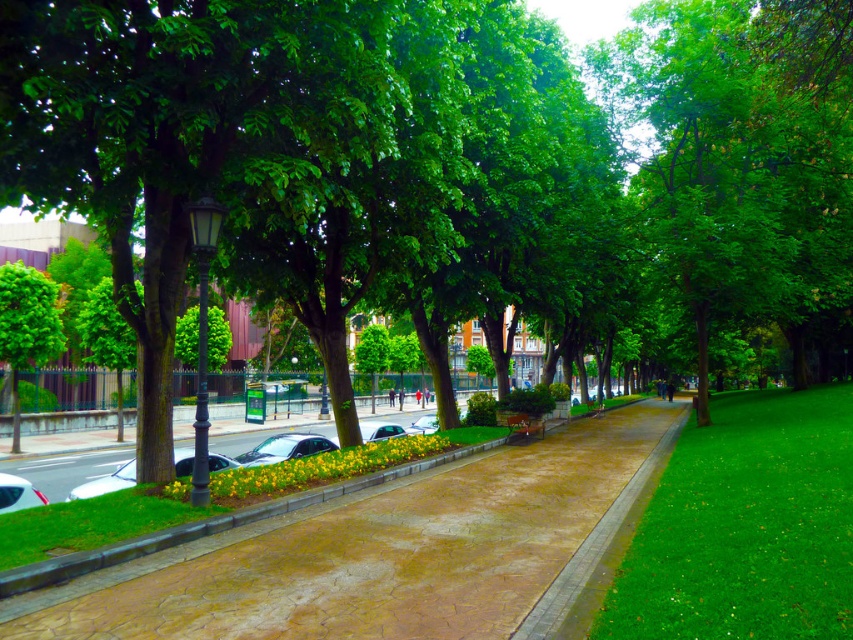
Is brown textured pavement at center positioned behind green grass at right?

Yes, it is.

This screenshot has height=640, width=853. I want to click on brown textured pavement at center, so click(383, 552).

Who is lower down, brown textured pavement at center or shiny silver car at lower left?

brown textured pavement at center is below.

Is point (573, 576) less distant than point (131, 477)?

That is True.

The height and width of the screenshot is (640, 853). What do you see at coordinates (383, 552) in the screenshot?
I see `brown textured pavement at center` at bounding box center [383, 552].

This screenshot has height=640, width=853. In order to click on brown textured pavement at center in this screenshot , I will do `click(383, 552)`.

Does green leafy tree at left appear on the right side of shiny silver car at lower left?

No, green leafy tree at left is not to the right of shiny silver car at lower left.

Is green leafy tree at left to the left of shiny silver car at lower left from the viewer's perspective?

Yes, green leafy tree at left is to the left of shiny silver car at lower left.

Which is behind, point (3, 289) or point (231, 460)?

The point (3, 289) is more distant.

The width and height of the screenshot is (853, 640). In order to click on green leafy tree at left in this screenshot , I will do `click(26, 326)`.